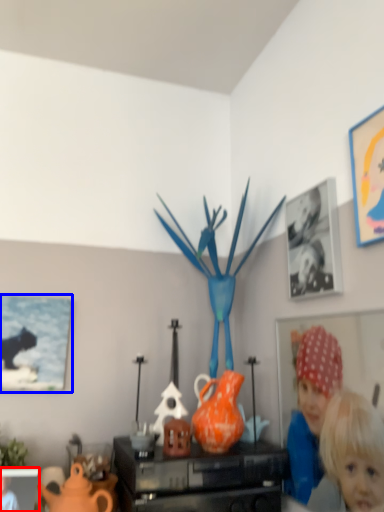
Question: Which point is closer to the camera, picture frame (highlighted by a red box) or picture frame (highlighted by a blue box)?

Choices:
 (A) picture frame
 (B) picture frame

Answer: (A)